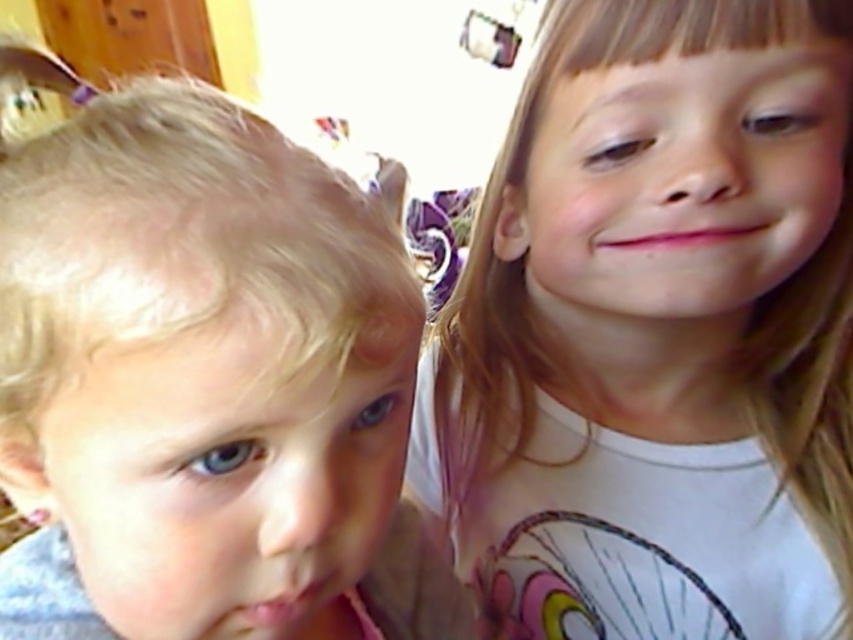
Question: Which of these objects is positioned closest to the smooth white shirt at right?

Choices:
 (A) pink matte lips at lower left
 (B) pink matte lips at center
 (C) blonde hair at left

Answer: (B)

Question: Does blonde hair at left have a larger size compared to pink matte lips at center?

Choices:
 (A) no
 (B) yes

Answer: (B)

Question: Does smooth white shirt at right appear over pink matte lips at center?

Choices:
 (A) no
 (B) yes

Answer: (A)

Question: Estimate the real-world distances between objects in this image. Which object is closer to the pink matte lips at lower left?

Choices:
 (A) pink matte lips at center
 (B) blonde hair at left

Answer: (B)

Question: Estimate the real-world distances between objects in this image. Which object is farther from the pink matte lips at center?

Choices:
 (A) smooth white shirt at right
 (B) blonde hair at left

Answer: (B)

Question: Does smooth white shirt at right have a lesser width compared to pink matte lips at center?

Choices:
 (A) no
 (B) yes

Answer: (A)